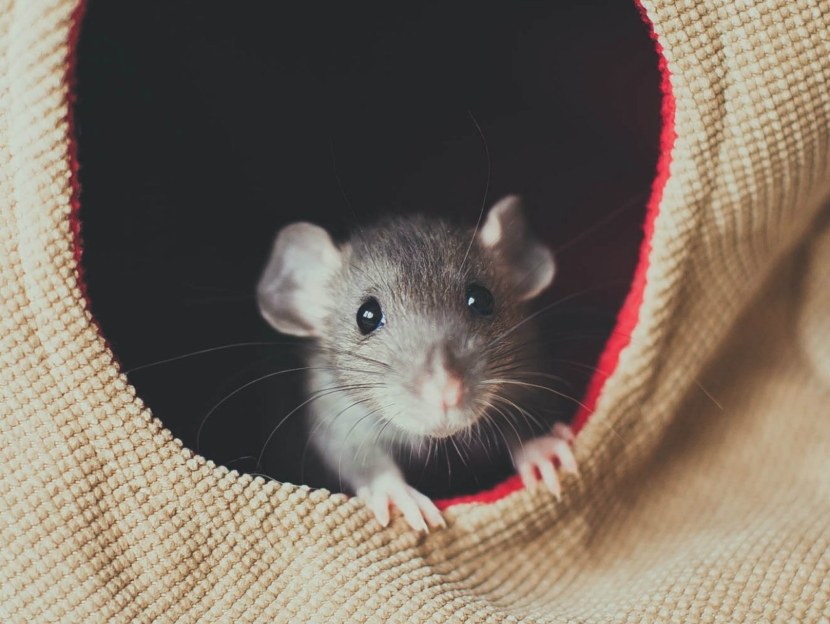
The image size is (830, 624). I want to click on right front leg, so click(x=339, y=441).